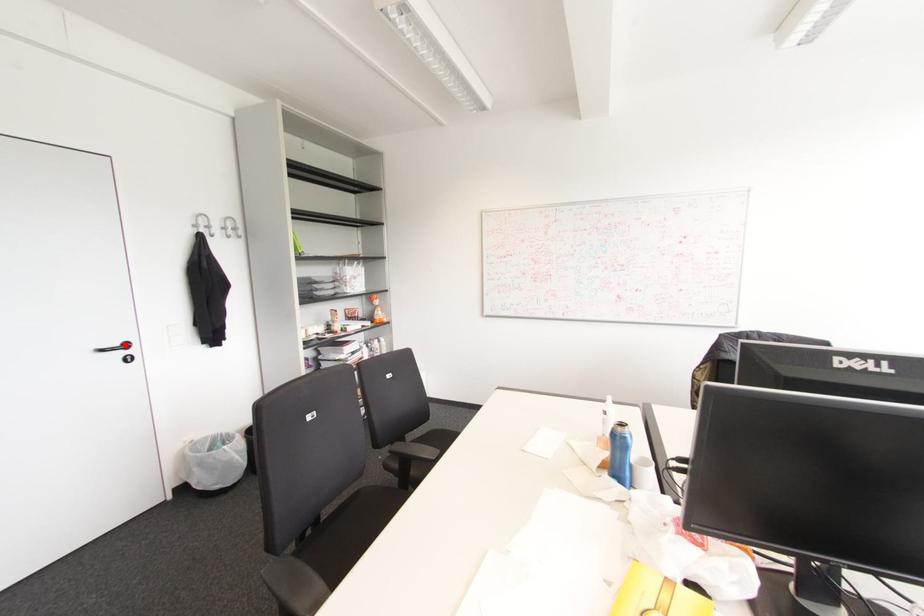
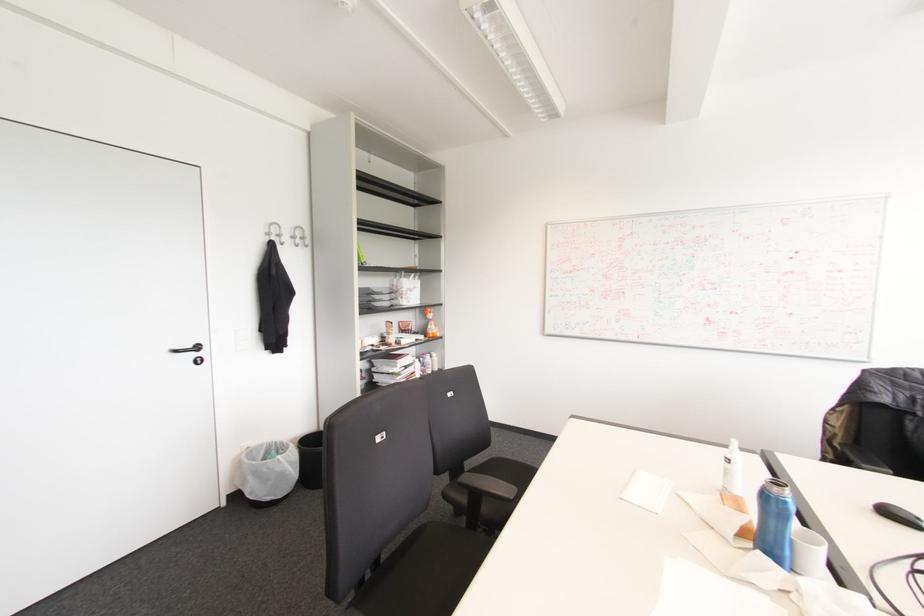
Where in the second image is the point corresponding to the highlighted location from the first image?

(197, 347)